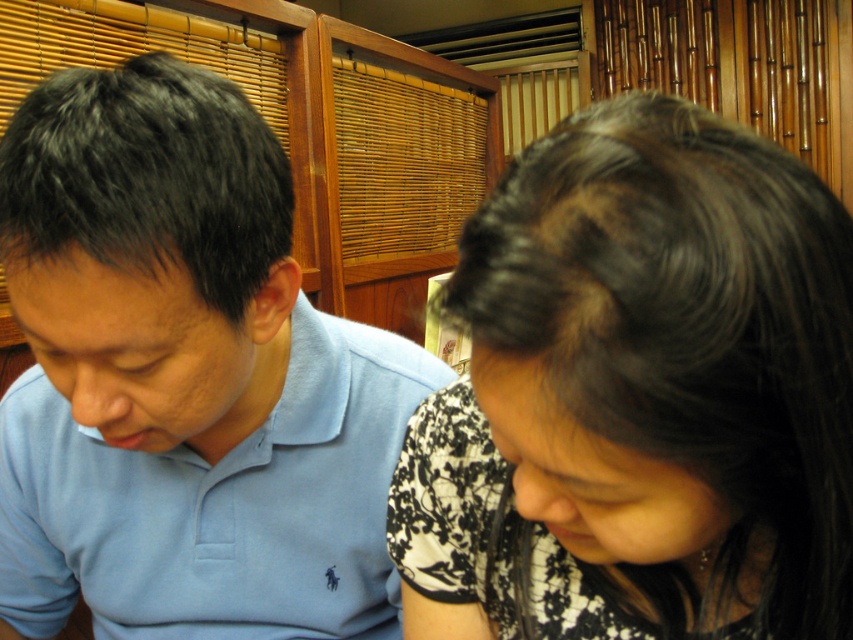
Does black floral shirt at upper right appear on the left side of light blue cotton polo shirt at left?

Incorrect, black floral shirt at upper right is not on the left side of light blue cotton polo shirt at left.

You are a GUI agent. You are given a task and a screenshot of the screen. Output one action in this format:
    pyautogui.click(x=<x>, y=<y>)
    Task: Click on the black floral shirt at upper right
    The image size is (853, 640).
    Given the screenshot: What is the action you would take?
    pyautogui.click(x=639, y=396)

This screenshot has width=853, height=640. Identify the location of black floral shirt at upper right. (639, 396).